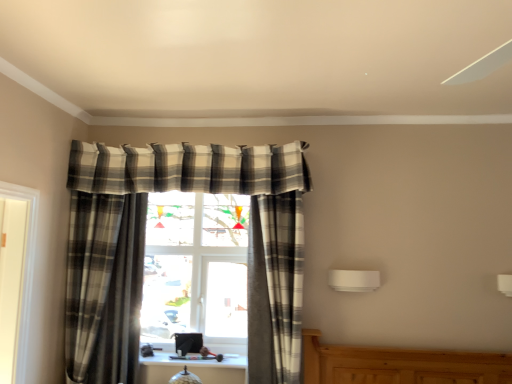
Question: From the image's perspective, is plaid fabric curtain at center, the first curtain positioned from the left, above or below plaid fabric curtain at right, arranged as the 1th curtain when viewed from the right?

Choices:
 (A) below
 (B) above

Answer: (B)

Question: Is point 75,196 positioned closer to the camera than point 265,263?

Choices:
 (A) closer
 (B) farther

Answer: (B)

Question: Is plaid fabric curtain at center, the 2th curtain in the right-to-left sequence, situated inside plaid fabric curtain at right, placed as the second curtain when sorted from left to right, or outside?

Choices:
 (A) inside
 (B) outside

Answer: (B)

Question: In terms of height, does plaid fabric curtain at right, placed as the second curtain when sorted from left to right, look taller or shorter compared to plaid fabric curtain at center, the 2th curtain in the right-to-left sequence?

Choices:
 (A) short
 (B) tall

Answer: (A)

Question: Do you think plaid fabric curtain at right, placed as the second curtain when sorted from left to right, is within plaid fabric curtain at center, the first curtain positioned from the left, or outside of it?

Choices:
 (A) inside
 (B) outside

Answer: (B)

Question: Looking at the image, does plaid fabric curtain at right, placed as the second curtain when sorted from left to right, seem bigger or smaller compared to plaid fabric curtain at center, the first curtain positioned from the left?

Choices:
 (A) big
 (B) small

Answer: (A)

Question: From the image's perspective, is plaid fabric curtain at right, arranged as the 1th curtain when viewed from the right, positioned above or below plaid fabric curtain at center, the first curtain positioned from the left?

Choices:
 (A) below
 (B) above

Answer: (A)